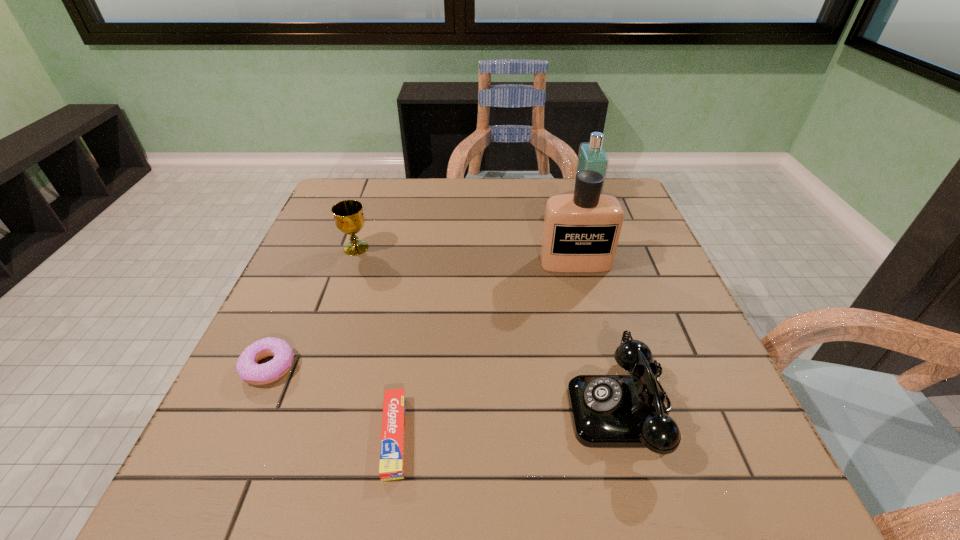
Image resolution: width=960 pixels, height=540 pixels. I want to click on the tallest object, so click(581, 231).

At what (x,y) coordinates should I click in order to perform the action: click on the nearer perfume. Please return your answer as a coordinate pair (x, y). The width and height of the screenshot is (960, 540). Looking at the image, I should click on (581, 231).

Where is `the shorter perfume`? This screenshot has height=540, width=960. the shorter perfume is located at coordinates (592, 156).

This screenshot has height=540, width=960. Identify the location of the farthest object. (592, 156).

Identify the location of chalice. (348, 214).

Where is `telephone`? The width and height of the screenshot is (960, 540). telephone is located at coordinates (608, 411).

Locate an element on the screen. doughnut is located at coordinates (247, 366).

At what (x,y) coordinates should I click in order to perform the action: click on toothpaste. Please return your answer as a coordinate pair (x, y). This screenshot has width=960, height=540. Looking at the image, I should click on (391, 467).

This screenshot has width=960, height=540. Identify the location of the third object from left to right. (391, 467).

The image size is (960, 540). I want to click on free spot located 0.120m on the front label of the taller perfume, so click(x=588, y=309).